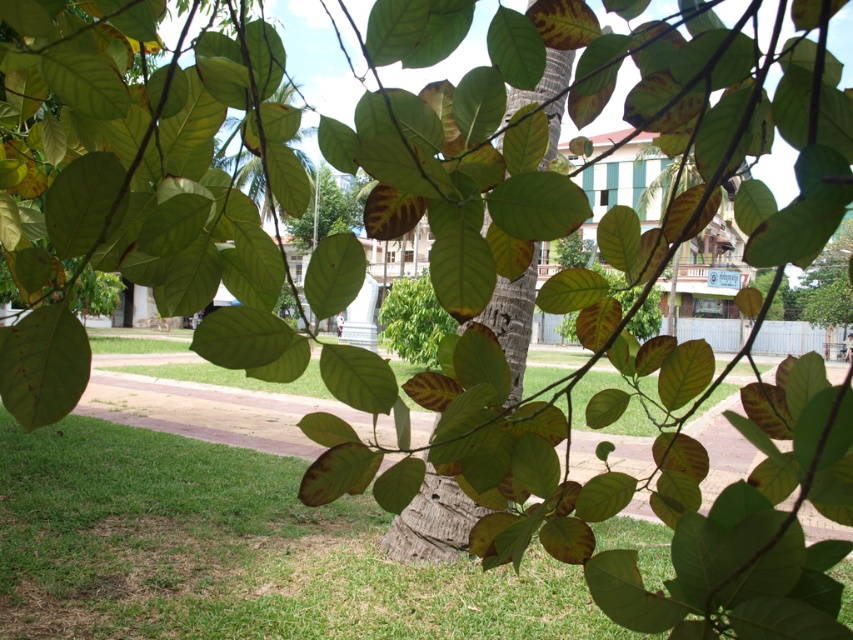
Question: In this image, where is green grass at lower left located relative to brown rough tree trunk at center?

Choices:
 (A) right
 (B) left

Answer: (B)

Question: Is green grass at lower left to the left of brown rough tree trunk at center from the viewer's perspective?

Choices:
 (A) no
 (B) yes

Answer: (B)

Question: Among these objects, which one is nearest to the camera?

Choices:
 (A) brown rough tree trunk at center
 (B) green grass at lower left

Answer: (A)

Question: Is green grass at lower left further to camera compared to brown rough tree trunk at center?

Choices:
 (A) no
 (B) yes

Answer: (B)